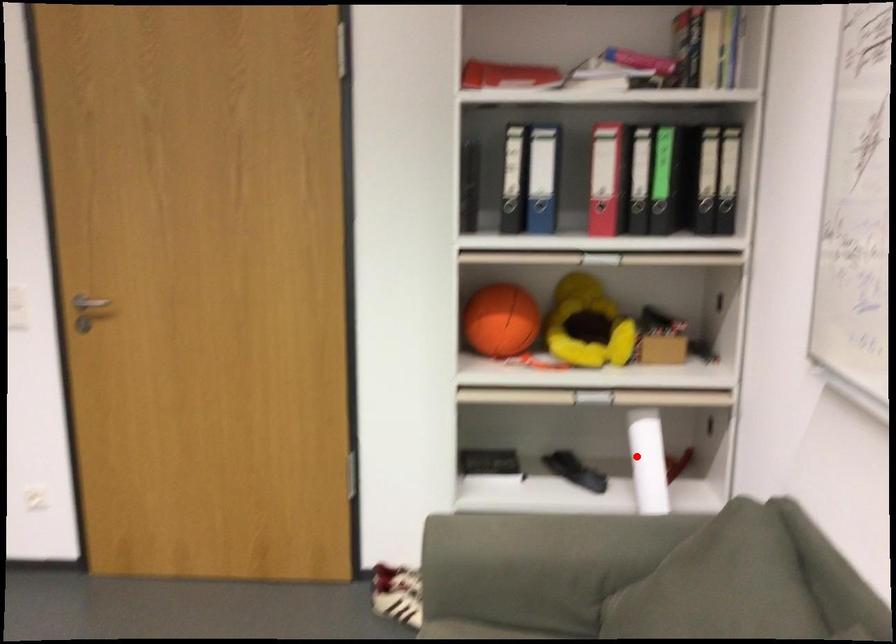
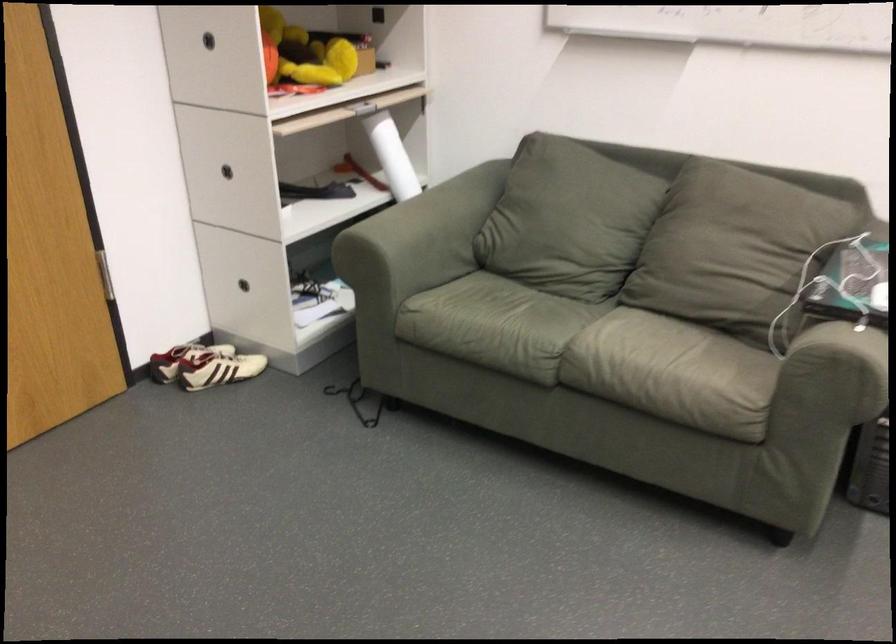
Question: I am providing you with two images of the same scene from different viewpoints. In image1, a red point is highlighted. Considering the same 3D point in image2, which of the following is correct?

Choices:
 (A) It is closer
 (B) It is farther

Answer: (B)